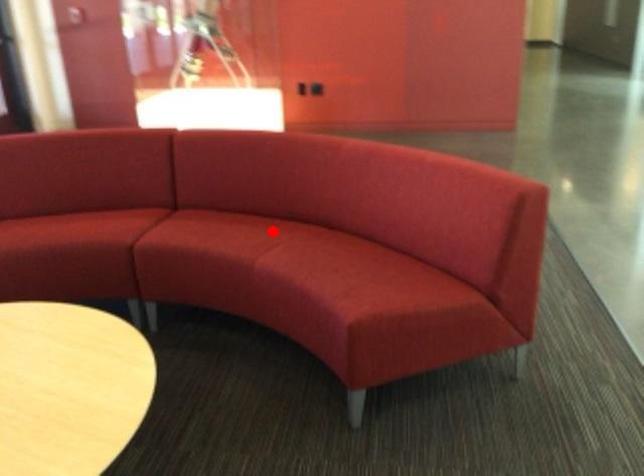
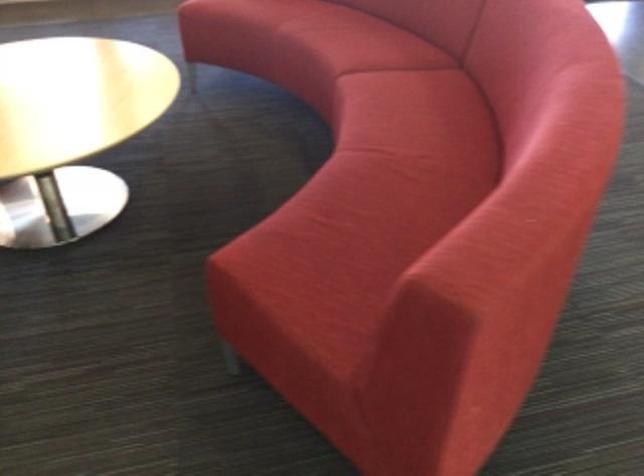
In the second image, find the point that corresponds to the highlighted location in the first image.

(422, 135)